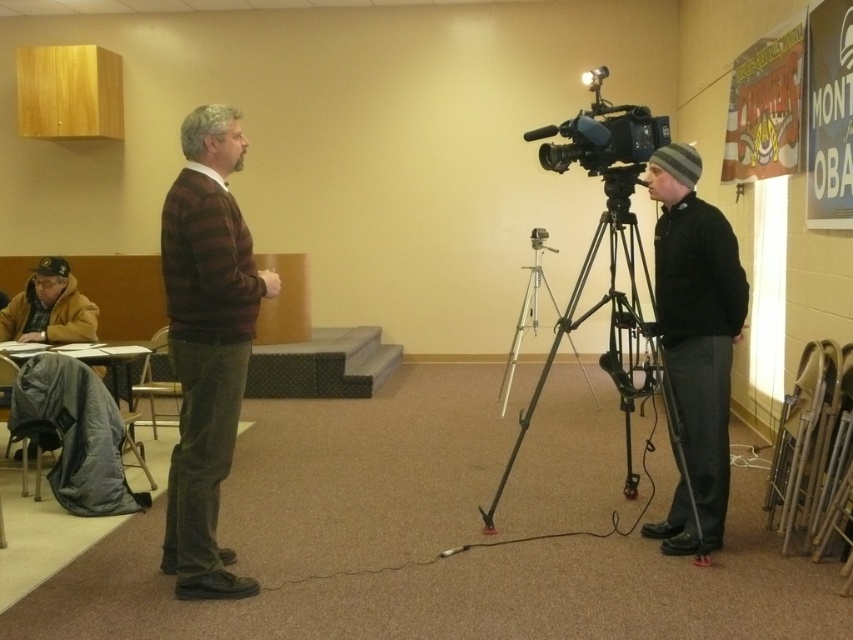
Based on the photo, is black knit beanie at center above black metal tripod at center?

No.

Is black knit beanie at center taller than black metal tripod at center?

Indeed, black knit beanie at center has a greater height compared to black metal tripod at center.

Find the location of `black knit beanie at center`. black knit beanie at center is located at coordinates (695, 340).

You are a GUI agent. You are given a task and a screenshot of the screen. Output one action in this format:
    pyautogui.click(x=<x>, y=<y>)
    Task: Click on the black knit beanie at center
    
    Given the screenshot: What is the action you would take?
    pyautogui.click(x=695, y=340)

Locate an element on the screen. This screenshot has width=853, height=640. striped sweater at center is located at coordinates (206, 344).

Is striped sweater at center taller than black metal tripod at center?

Correct, striped sweater at center is much taller as black metal tripod at center.

Measure the distance between striped sweater at center and camera.

striped sweater at center and camera are 2.73 meters apart.

Where is `striped sweater at center`? striped sweater at center is located at coordinates (206, 344).

Which is behind, point (187, 360) or point (590, 150)?

The point (590, 150) is more distant.

Locate an element on the screen. The height and width of the screenshot is (640, 853). striped sweater at center is located at coordinates (206, 344).